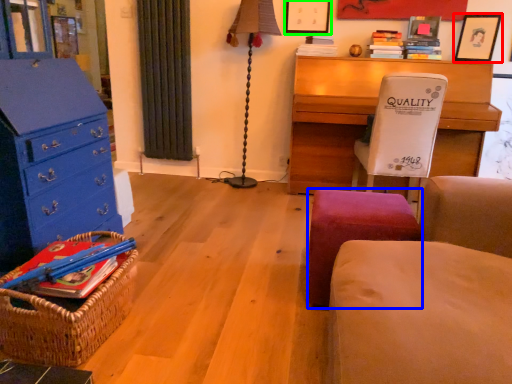
Question: Which object is positioned closest to picture frame (highlighted by a red box)? Select from stool (highlighted by a blue box) and picture frame (highlighted by a green box).

Choices:
 (A) stool
 (B) picture frame

Answer: (B)